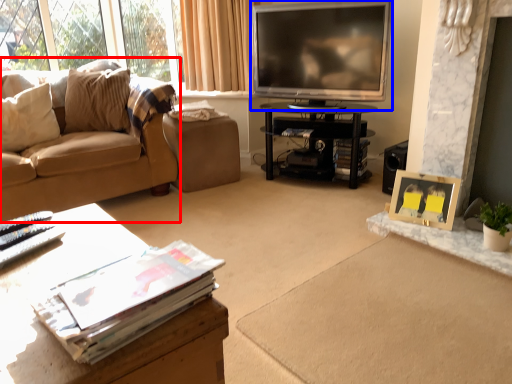
Question: Which object appears closest to the camera in this image, studio couch (highlighted by a red box) or television (highlighted by a blue box)?

Choices:
 (A) studio couch
 (B) television

Answer: (A)